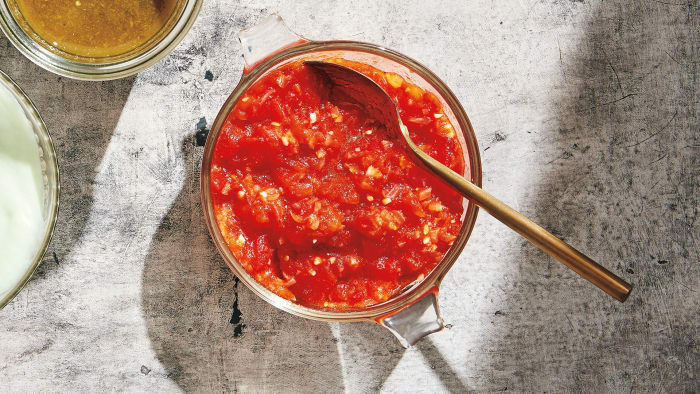
Find the location of `counter`. counter is located at coordinates (169, 275).